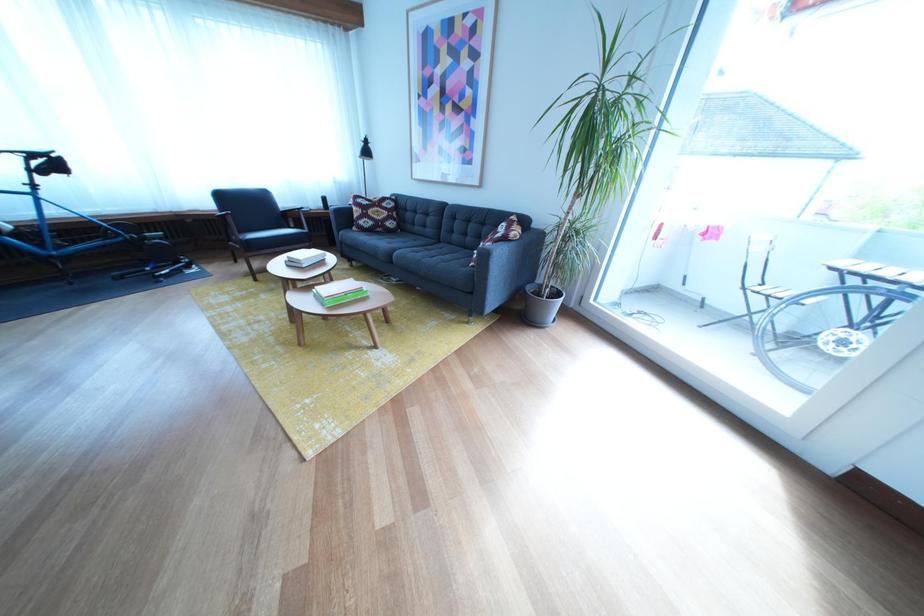
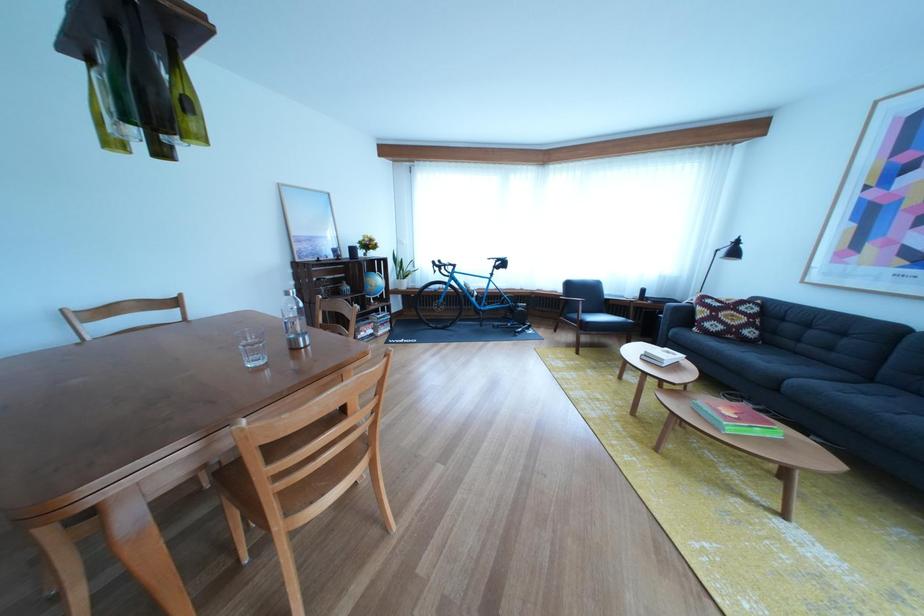
Question: How did the camera likely rotate?

Choices:
 (A) Left
 (B) Right
 (C) Up
 (D) Down

Answer: (A)